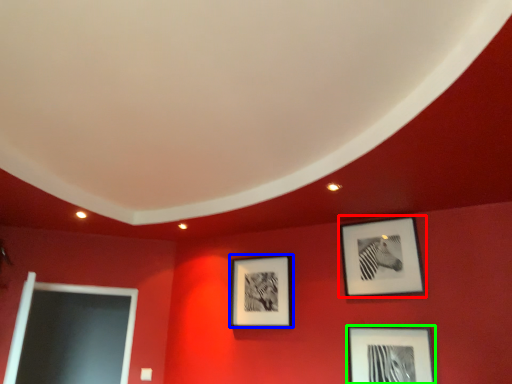
Question: Which is farther away from picture frame (highlighted by a red box)? picture frame (highlighted by a blue box) or picture frame (highlighted by a green box)?

Choices:
 (A) picture frame
 (B) picture frame

Answer: (A)